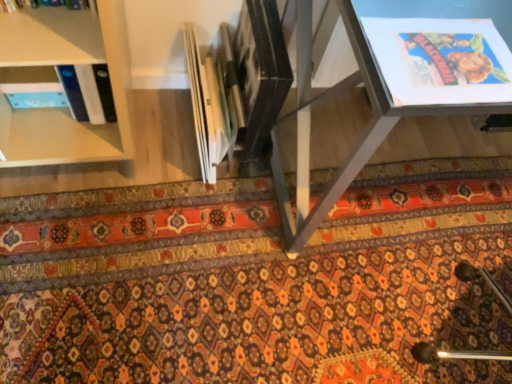
Where is `vacant space in carpeted mat at center (from a real-world perspective)`? This screenshot has height=384, width=512. vacant space in carpeted mat at center (from a real-world perspective) is located at coordinates click(262, 296).